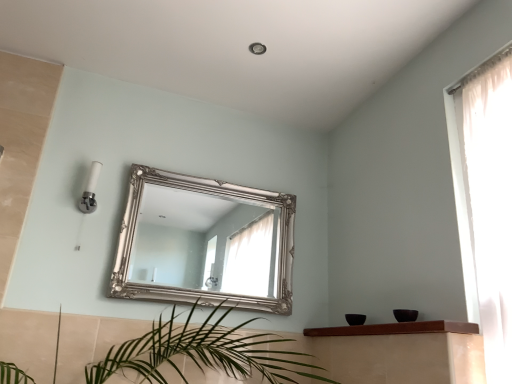
Question: In terms of width, does silver ornate mirror at center look wider or thinner when compared to brown wooden shelf at lower center?

Choices:
 (A) wide
 (B) thin

Answer: (B)

Question: Looking at the image, does silver ornate mirror at center seem bigger or smaller compared to brown wooden shelf at lower center?

Choices:
 (A) small
 (B) big

Answer: (B)

Question: Is silver ornate mirror at center taller or shorter than brown wooden shelf at lower center?

Choices:
 (A) tall
 (B) short

Answer: (A)

Question: Relative to silver ornate mirror at center, is brown wooden shelf at lower center in front or behind?

Choices:
 (A) front
 (B) behind

Answer: (A)

Question: Based on their sizes in the image, would you say brown wooden shelf at lower center is bigger or smaller than silver ornate mirror at center?

Choices:
 (A) small
 (B) big

Answer: (A)

Question: Is brown wooden shelf at lower center situated inside silver ornate mirror at center or outside?

Choices:
 (A) inside
 (B) outside

Answer: (B)

Question: Does point (366, 334) appear closer or farther from the camera than point (262, 240)?

Choices:
 (A) closer
 (B) farther

Answer: (A)